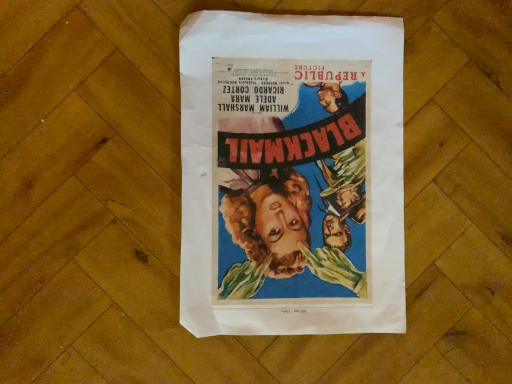
Describe the element at coordinates (291, 174) in the screenshot. Image resolution: width=512 pixels, height=384 pixels. I see `vivid paper poster at center` at that location.

What are the coordinates of `vivid paper poster at center` in the screenshot? It's located at (291, 174).

The image size is (512, 384). I want to click on vivid paper poster at center, so click(x=291, y=174).